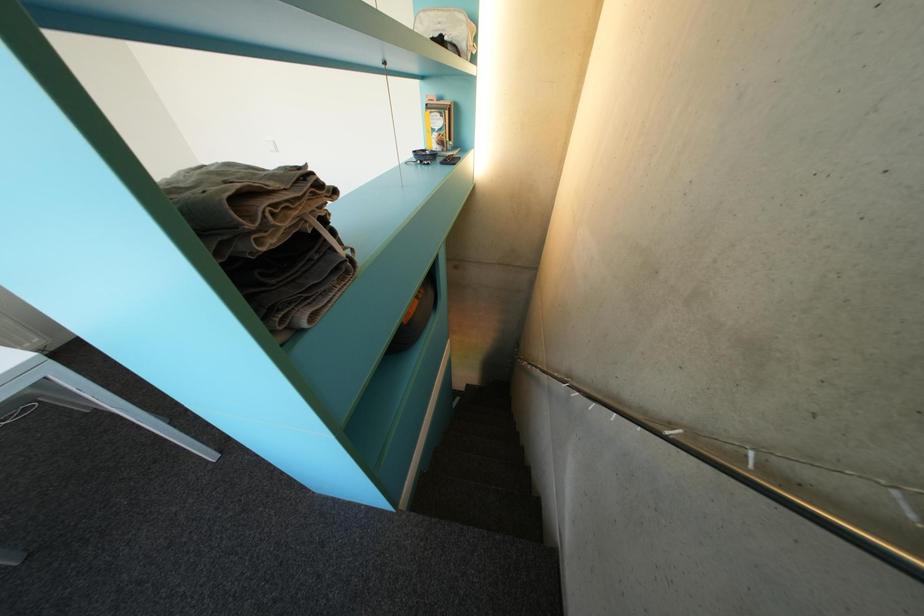
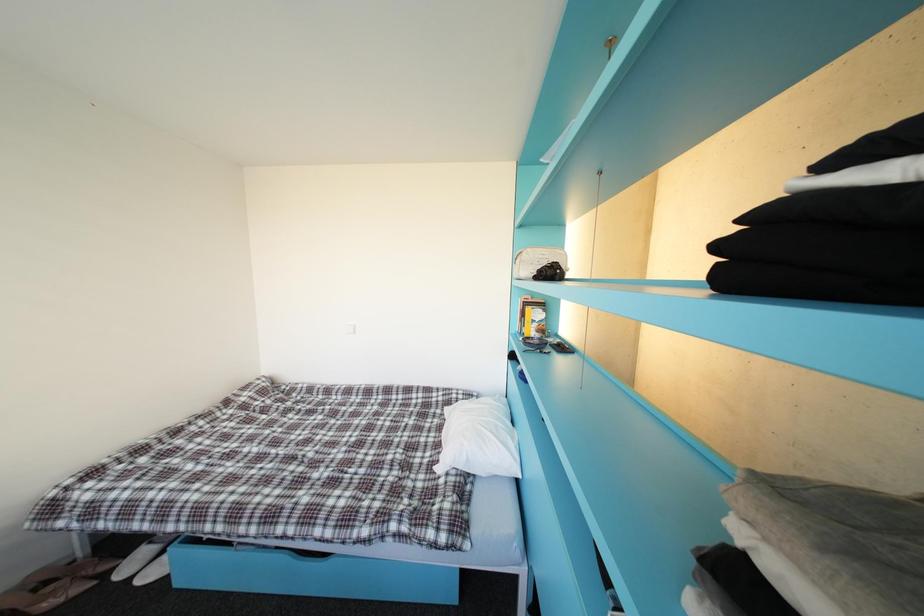
Question: How did the camera likely rotate?

Choices:
 (A) Left
 (B) Right
 (C) Up
 (D) Down

Answer: (C)